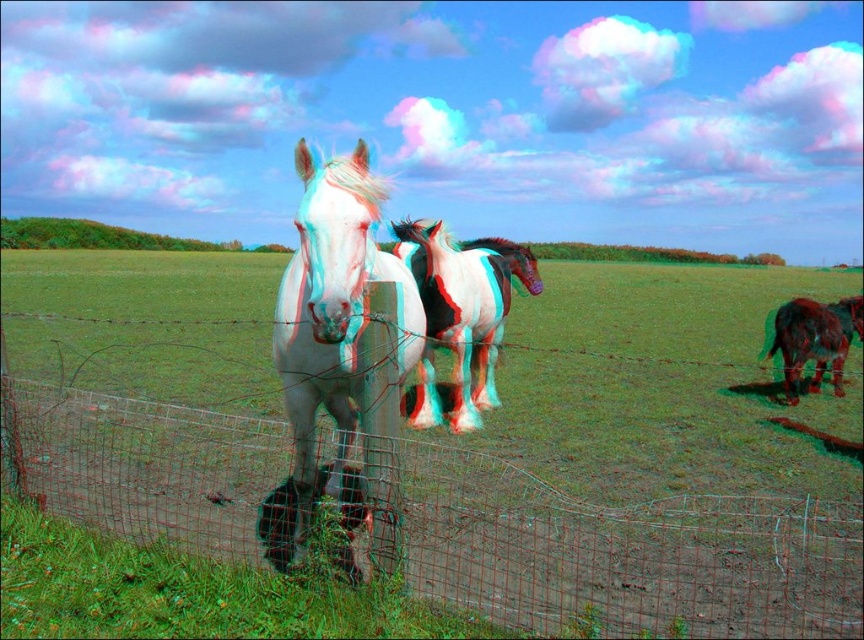
How much distance is there between speckled paint horse at center and shiny brown horse at right?

They are 3.06 meters apart.

Can you confirm if speckled paint horse at center is positioned to the left of shiny brown horse at right?

Correct, you'll find speckled paint horse at center to the left of shiny brown horse at right.

Between point (433, 232) and point (842, 333), which one is positioned in front?

Point (433, 232) is in front.

I want to click on speckled paint horse at center, so click(461, 312).

Who is positioned more to the left, metal wire fence at lower center or white glossy horse at center?

white glossy horse at center

Who is more distant from viewer, [624,586] or [348,205]?

Point [624,586]

In order to click on metal wire fence at lower center in this screenshot , I will do `click(611, 552)`.

Between white glossy horse at center and speckled paint horse at center, which one is positioned lower?

Positioned lower is white glossy horse at center.

Between point (359, 474) and point (458, 285), which one is positioned behind?

The point (458, 285) is more distant.

Identify the location of white glossy horse at center. (340, 360).

This screenshot has height=640, width=864. I want to click on white glossy horse at center, so click(x=340, y=360).